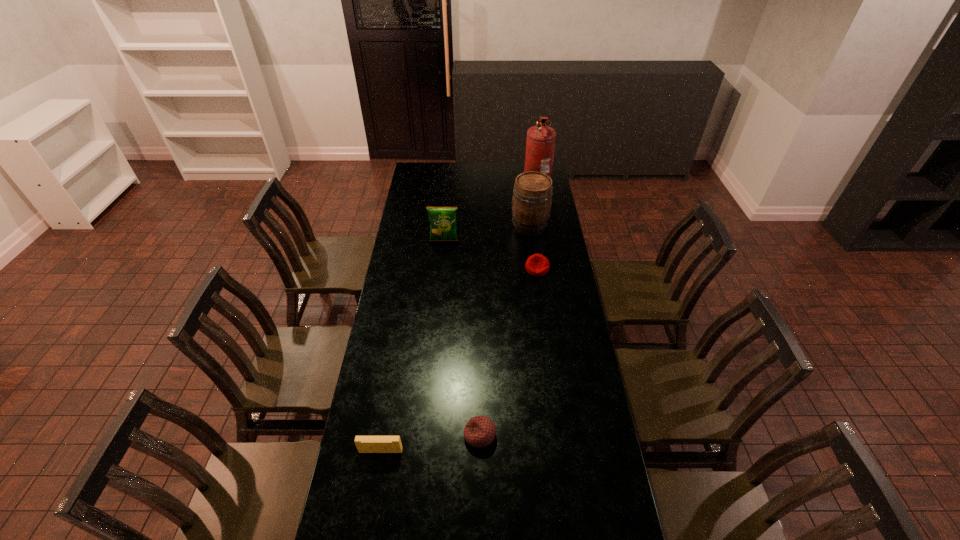
At what (x,y) coordinates should I click in order to perform the action: click on free spot between the second tallest object and the farther beanbag. Please return your answer as a coordinate pair (x, y). The width and height of the screenshot is (960, 540). Looking at the image, I should click on (533, 247).

Locate an element on the screen. This screenshot has width=960, height=540. free area in between the fourth tallest object and the left beanbag is located at coordinates (430, 443).

You are a GUI agent. You are given a task and a screenshot of the screen. Output one action in this format:
    pyautogui.click(x=<x>, y=<y>)
    Task: Click on the vacant space in between the fourth tallest object and the fourth shortest object
    This screenshot has height=540, width=960.
    Given the screenshot: What is the action you would take?
    pyautogui.click(x=413, y=346)

At what (x,y) coordinates should I click in order to perform the action: click on empty location between the videotape and the right beanbag. Please return your answer as a coordinate pair (x, y). This screenshot has width=960, height=540. Looking at the image, I should click on (459, 360).

Find the location of a particular element. The image size is (960, 540). free space between the farthest object and the crisp (potato chip) is located at coordinates (490, 213).

Identify the location of unoccupied area between the cider and the left beanbag. The image size is (960, 540). (505, 330).

The height and width of the screenshot is (540, 960). Identify the location of vacant area between the nearer beanbag and the cider. (505, 330).

Point out which object is positioned as the nearest to the third nearest object. Please provide its 2D coordinates. Your answer should be formatted as a tuple, i.e. [(x, y)], where the tuple contains the x and y coordinates of a point satisfying the conditions above.

[(531, 203)]

Identify which object is located as the nearest to the nearer beanbag. Please provide its 2D coordinates. Your answer should be formatted as a tuple, i.e. [(x, y)], where the tuple contains the x and y coordinates of a point satisfying the conditions above.

[(365, 444)]

Choose which beanbag is the second nearest neighbor to the second tallest object. Please provide its 2D coordinates. Your answer should be formatted as a tuple, i.e. [(x, y)], where the tuple contains the x and y coordinates of a point satisfying the conditions above.

[(479, 431)]